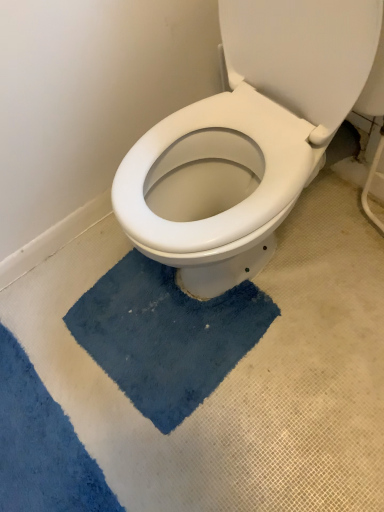
At what (x,y) coordinates should I click in order to perform the action: click on vacant area to the right of blue plush bath mat at lower center, marked as the 2th bath mat in a right-to-left arrangement. Please return your answer as a coordinate pair (x, y). The width and height of the screenshot is (384, 512). Looking at the image, I should click on (158, 428).